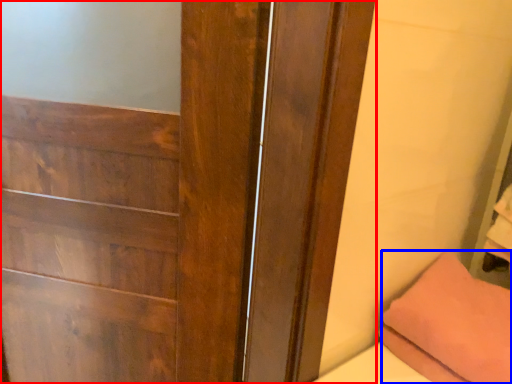
Question: Which object appears closest to the camera in this image, door (highlighted by a red box) or pillow (highlighted by a blue box)?

Choices:
 (A) door
 (B) pillow

Answer: (A)